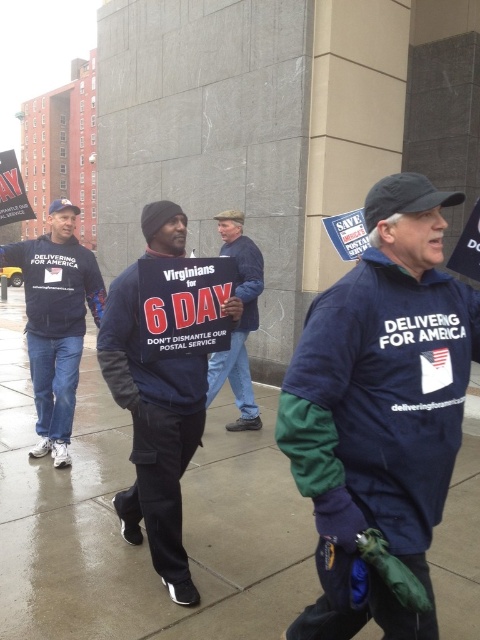
You are a delivery person carrying a package that requires a dry path. You see the wet concrete sidewalk at center and the dark blue sweatshirt at center. Which path should you choose to avoid getting the package wet?

The dark blue sweatshirt at center is 4.52 meters away from the wet concrete sidewalk at center, so choosing the path near the dark blue sweatshirt at center would keep the package dry as it is farther from the wet area.

You are a delivery person with a 2.5 feet wide package. You need to cross the wet concrete sidewalk at center while avoiding the dark blue sweatshirt at center. Is there enough space to pass safely?

The wet concrete sidewalk at center is narrower than the dark blue sweatshirt at center, so there might not be enough space to pass safely with a 2.5 feet wide package. Consider an alternative route.

You are a photographer trying to capture a photo of the protest. You want to ensure both the navy blue jacket at center and the matte black jacket at left are in the frame. Based on their positions, which one should you focus on first to include both in the shot?

You should focus on the matte black jacket at left first because the navy blue jacket at center is to the right of it, so starting with the leftmost subject ensures both are included in the frame.